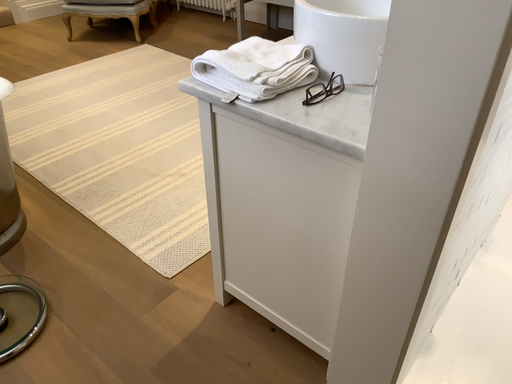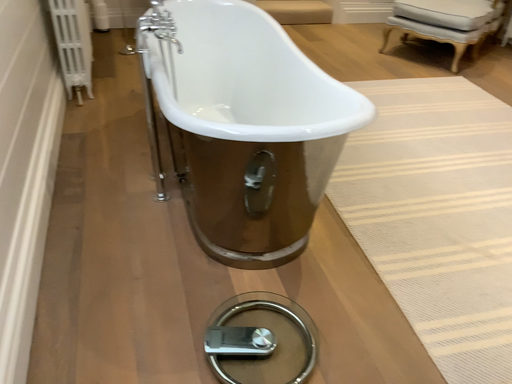
Question: How did the camera likely rotate when shooting the video?

Choices:
 (A) rotated upward
 (B) rotated downward

Answer: (A)